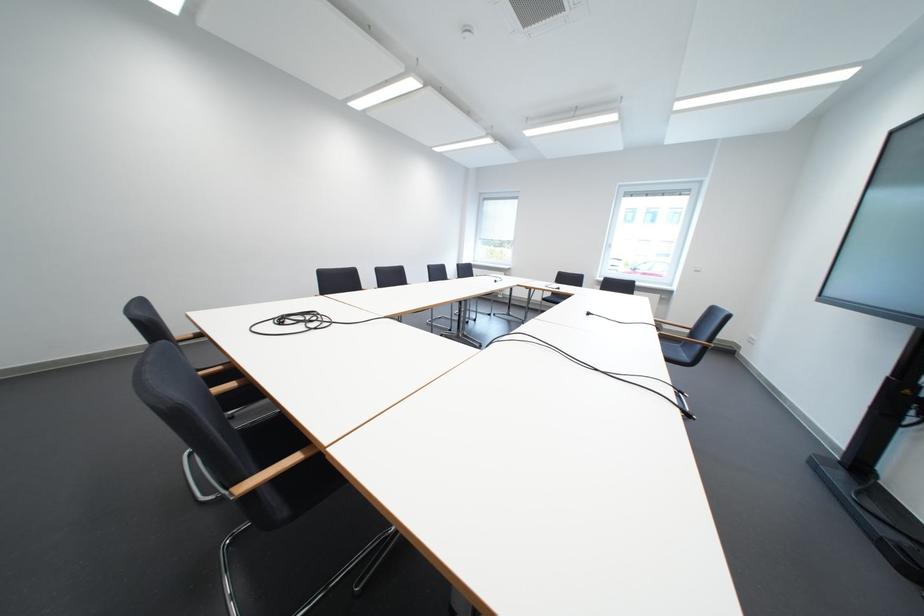
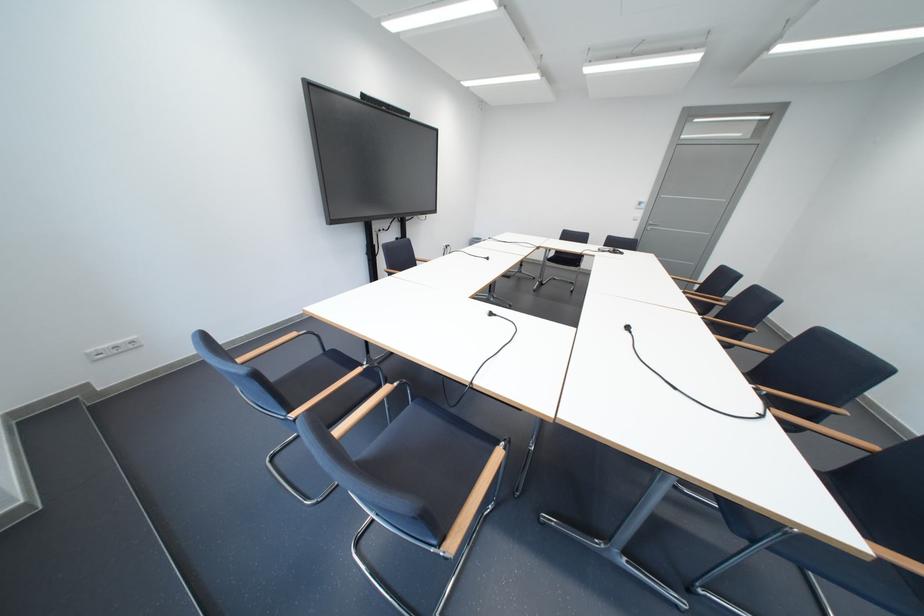
Question: I am providing you with two images of the same scene from different viewpoints. After the viewpoint changes to image2, which objects are now occluded?

Choices:
 (A) white bathtub knob
 (B) black chair sitting surface
 (C) white power outlets
 (D) blue chair sitting surface

Answer: (B)